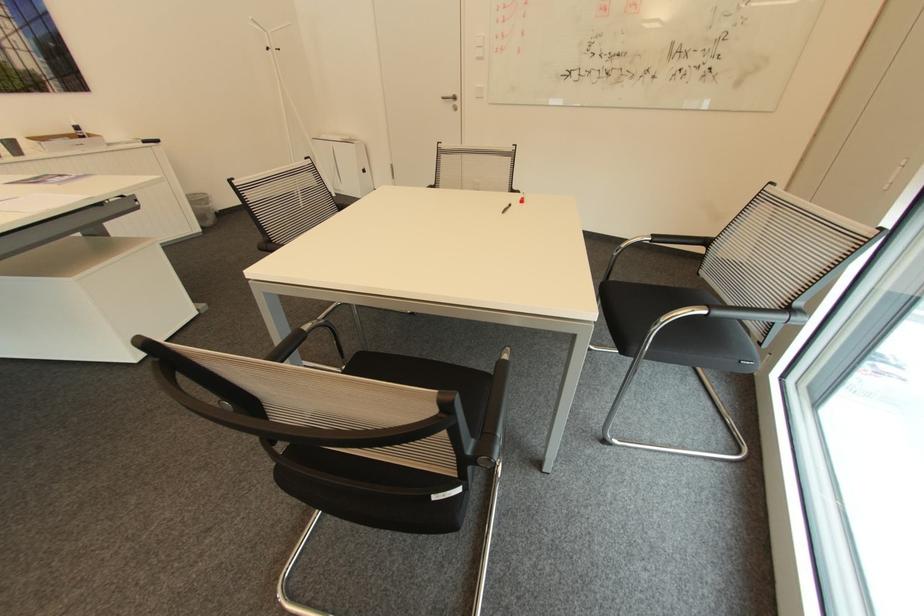
What are the coordinates of `silver door handle` in the screenshot? It's located at (450, 99).